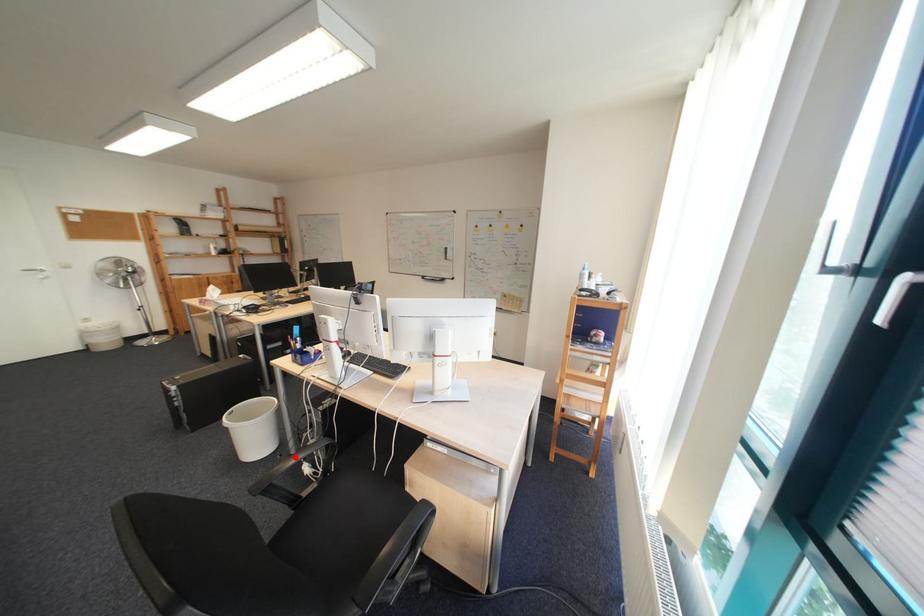
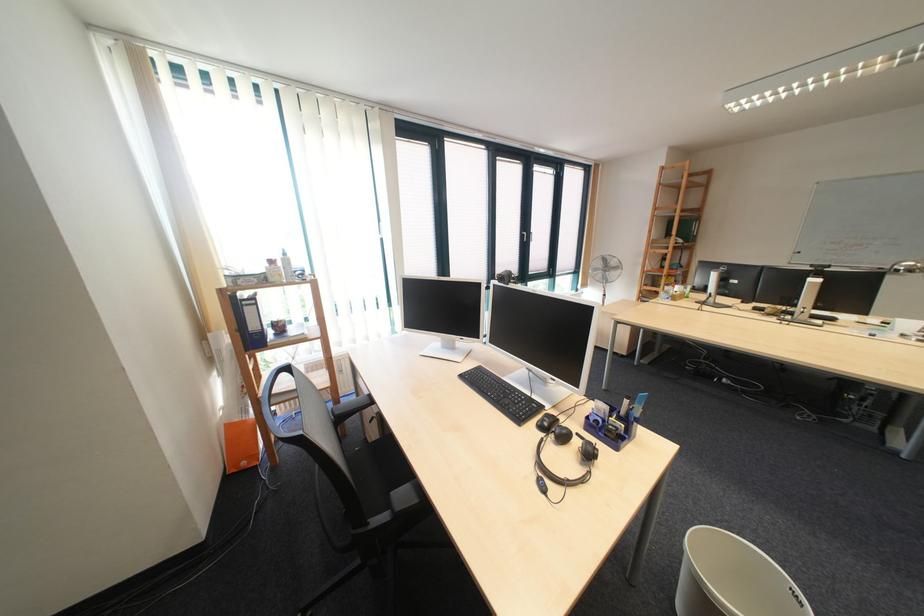
Question: I am providing you with two images of the same scene from different viewpoints. A red point is marked on the first image. At the location where the point appears in image 1, is it still visible in image 2?

Choices:
 (A) Yes
 (B) No

Answer: (B)